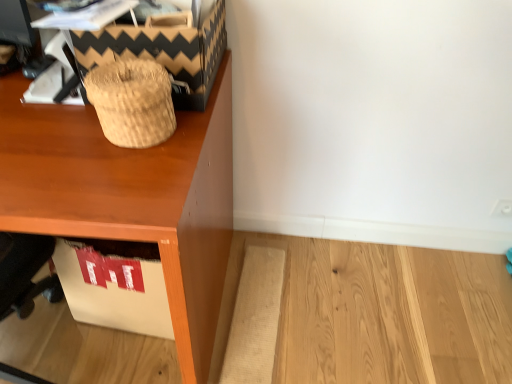
At what (x,y) coordinates should I click in order to perform the action: click on free space in front of woven straw basket at upper left. Please return your answer as a coordinate pair (x, y). This screenshot has height=384, width=512. Looking at the image, I should click on (110, 185).